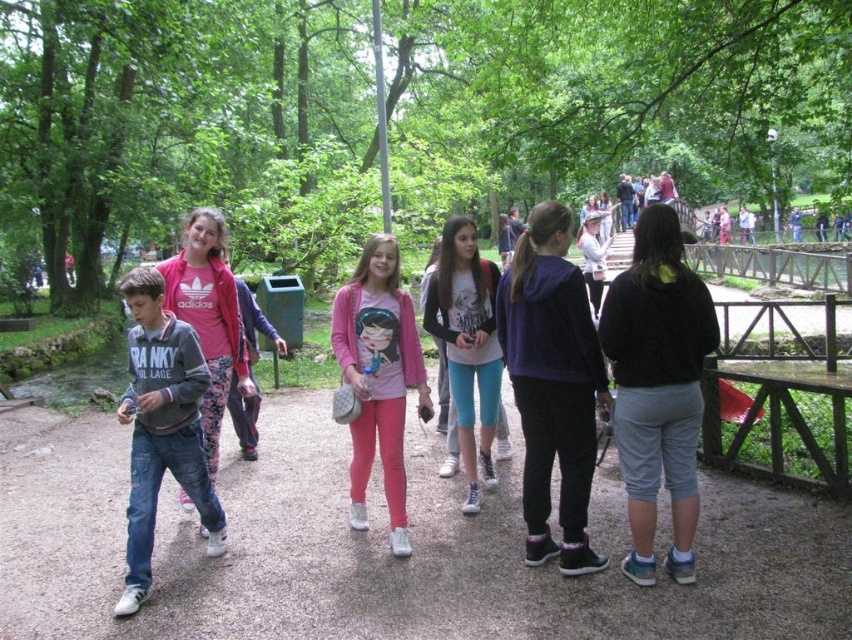
Question: Is pink leggings at center above pink matte leggings at center?

Choices:
 (A) yes
 (B) no

Answer: (B)

Question: Does pink leggings at center have a larger size compared to purple fleece jacket at center?

Choices:
 (A) yes
 (B) no

Answer: (B)

Question: Among these points, which one is farthest from the camera?

Choices:
 (A) (694, 452)
 (B) (363, 400)

Answer: (B)

Question: Considering the real-world distances, which object is farthest from the pink matte leggings at center?

Choices:
 (A) pink leggings at center
 (B) denim jeans at left
 (C) teal leggings at center
 (D) purple fleece jacket at center

Answer: (B)

Question: Can you confirm if dark gray hoodie at center is positioned to the right of teal leggings at center?

Choices:
 (A) yes
 (B) no

Answer: (A)

Question: Which point appears closest to the camera in this image?

Choices:
 (A) (367, 465)
 (B) (482, 262)
 (C) (560, 499)
 (D) (151, 608)

Answer: (D)